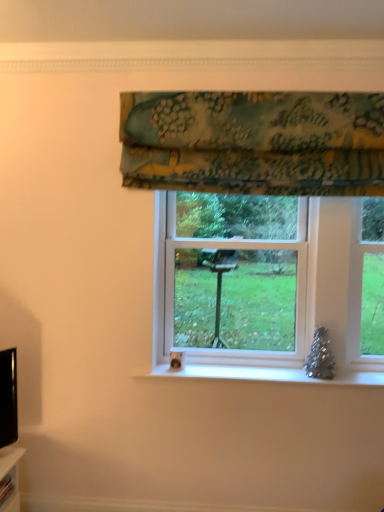
Question: Considering the positions of textured floral fabric at upper center and white plastic window at center in the image, is textured floral fabric at upper center taller or shorter than white plastic window at center?

Choices:
 (A) tall
 (B) short

Answer: (B)

Question: Is textured floral fabric at upper center bigger or smaller than white plastic window at center?

Choices:
 (A) small
 (B) big

Answer: (A)

Question: From the image's perspective, is textured floral fabric at upper center positioned above or below white plastic window at center?

Choices:
 (A) above
 (B) below

Answer: (A)

Question: Relative to textured floral fabric at upper center, is white plastic window at center in front or behind?

Choices:
 (A) behind
 (B) front

Answer: (A)

Question: Is white plastic window at center bigger or smaller than textured floral fabric at upper center?

Choices:
 (A) big
 (B) small

Answer: (A)

Question: From a real-world perspective, relative to textured floral fabric at upper center, is white plastic window at center vertically above or below?

Choices:
 (A) above
 (B) below

Answer: (B)

Question: Is point (226, 206) positioned closer to the camera than point (134, 177)?

Choices:
 (A) closer
 (B) farther

Answer: (B)